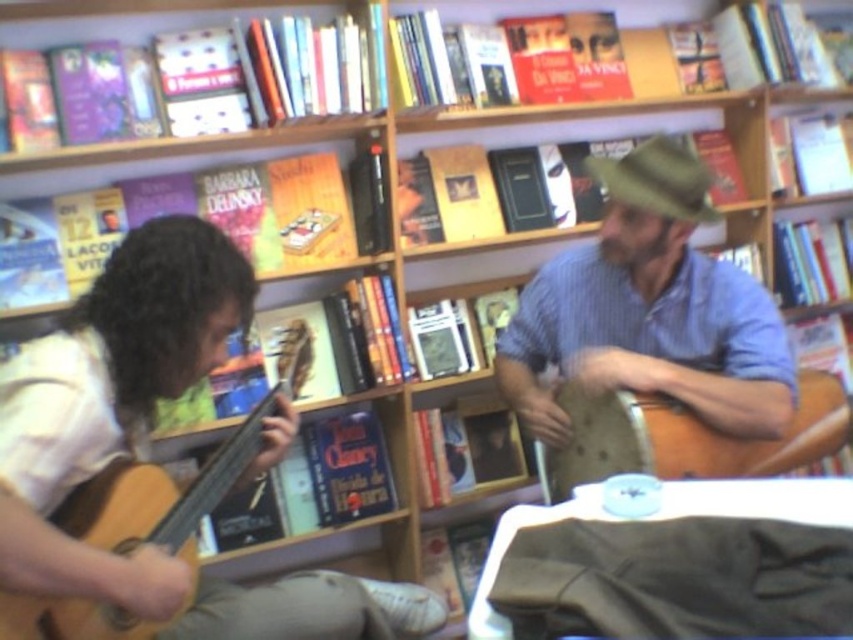
Question: In this image, where is blue striped shirt at center located relative to brown wooden guitar at right?

Choices:
 (A) right
 (B) left

Answer: (B)

Question: Observing the image, what is the correct spatial positioning of brown wooden guitar at right in reference to wooden acoustic guitar at left?

Choices:
 (A) below
 (B) above

Answer: (B)

Question: Which object is the farthest from the wooden acoustic guitar at left?

Choices:
 (A) brown wooden guitar at right
 (B) blue striped shirt at center

Answer: (A)

Question: Which of the following is the closest to the observer?

Choices:
 (A) wooden acoustic guitar at left
 (B) brown wooden guitar at right
 (C) blue striped shirt at center

Answer: (A)

Question: Based on their relative distances, which object is farther from the blue striped shirt at center?

Choices:
 (A) brown wooden guitar at right
 (B) wooden acoustic guitar at left

Answer: (B)

Question: Where is brown wooden guitar at right located in relation to wooden acoustic guitar at left in the image?

Choices:
 (A) left
 (B) right

Answer: (B)